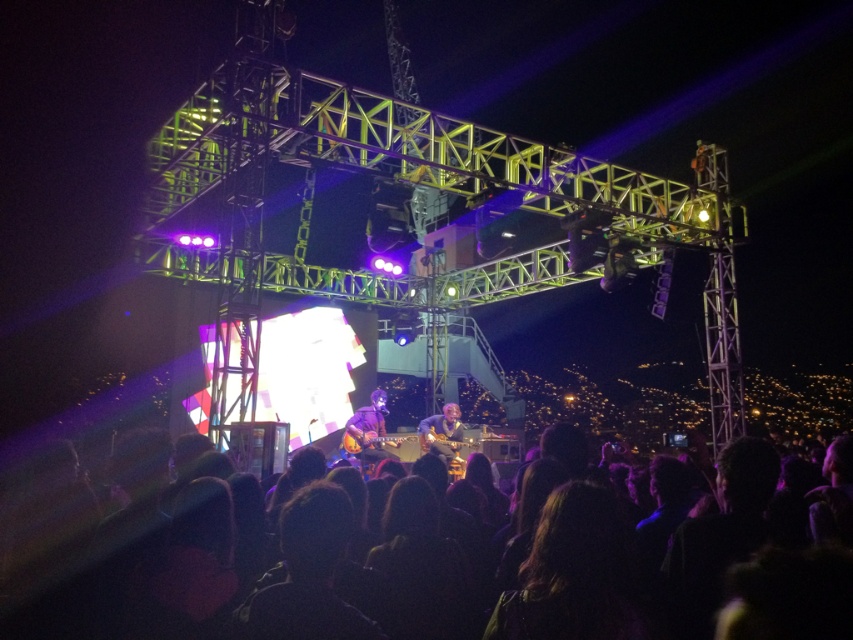
Consider the image. You are a photographer at the concert and want to capture a photo of the purple matte guitar at center and the black hair at lower center. Based on their positions, which object should you focus on first if you start from the left side of the stage?

The purple matte guitar at center should be focused on first because the black hair at lower center is to the right of it, meaning the guitar is positioned to the left of the black hair.

You are a photographer at the concert and want to capture a closeup shot of the black hair at lower center and the matte brown guitar at center in the same frame. Given that your camera has a maximum focus range of 20 meters, will you be able to capture both subjects clearly?

The black hair at lower center is 20.84 meters from the matte brown guitar at center, which exceeds the camera maximum focus range of 20 meters. Therefore, you cannot capture both subjects clearly in the same frame.